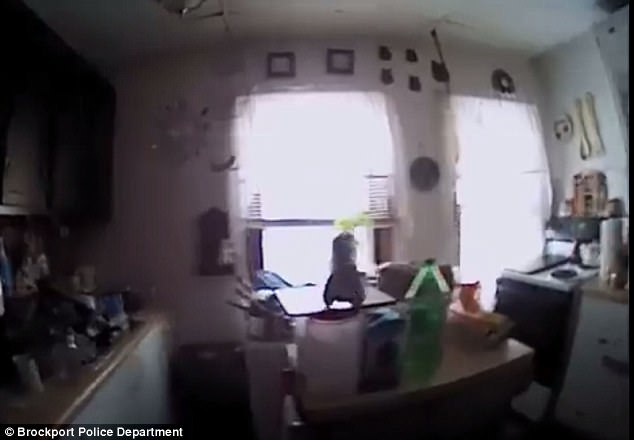
The image size is (634, 440). I want to click on table, so click(454, 366).